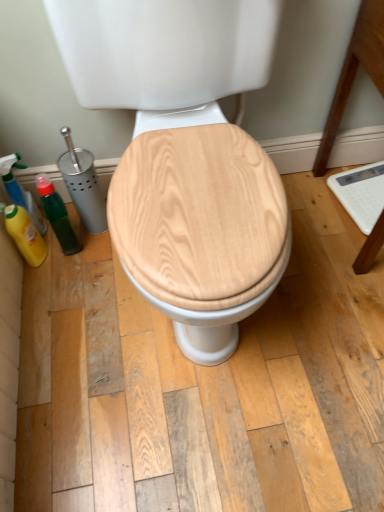
Question: Based on their sizes in the image, would you say wooden toilet seat at center is bigger or smaller than yellow matte bottle at left, the second cleaning product when ordered from top to bottom?

Choices:
 (A) small
 (B) big

Answer: (B)

Question: Looking at their shapes, would you say wooden toilet seat at center is wider or thinner than yellow matte bottle at left, the 1th cleaning product positioned from the bottom?

Choices:
 (A) thin
 (B) wide

Answer: (B)

Question: Which object is the closest to the matte green spray bottle at left, the first cleaning product when ordered from top to bottom?

Choices:
 (A) yellow matte bottle at left, the 1th cleaning product positioned from the bottom
 (B) wooden toilet seat at center
 (C) green matte bottle at left

Answer: (A)

Question: Which is nearer to the green matte bottle at left?

Choices:
 (A) yellow matte bottle at left, the 1th cleaning product positioned from the bottom
 (B) wooden toilet seat at center
 (C) matte green spray bottle at left, the first cleaning product when ordered from top to bottom

Answer: (C)